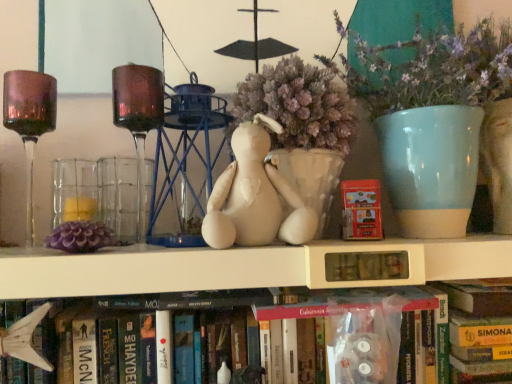
Question: Considering the relative positions of white fabric stuffed animal at center and matte red paperback book at center in the image provided, is white fabric stuffed animal at center in front of matte red paperback book at center?

Choices:
 (A) no
 (B) yes

Answer: (B)

Question: From the image's perspective, is white fabric stuffed animal at center on matte red paperback book at center?

Choices:
 (A) yes
 (B) no

Answer: (A)

Question: Is white fabric stuffed animal at center smaller than matte red paperback book at center?

Choices:
 (A) yes
 (B) no

Answer: (B)

Question: Is there a large distance between white fabric stuffed animal at center and matte red paperback book at center?

Choices:
 (A) no
 (B) yes

Answer: (A)

Question: Is white fabric stuffed animal at center turned away from matte red paperback book at center?

Choices:
 (A) yes
 (B) no

Answer: (B)

Question: In terms of width, does hardcover book at lower center, the first book in the right-to-left sequence, look wider or thinner when compared to white matte shelf at center?

Choices:
 (A) wide
 (B) thin

Answer: (B)

Question: In the image, is hardcover book at lower center, the 2th book from the left, positioned in front of or behind white matte shelf at center?

Choices:
 (A) front
 (B) behind

Answer: (B)

Question: From their relative heights in the image, would you say hardcover book at lower center, the 2th book from the left, is taller or shorter than white matte shelf at center?

Choices:
 (A) tall
 (B) short

Answer: (A)

Question: Does point (490, 375) appear closer or farther from the camera than point (419, 263)?

Choices:
 (A) farther
 (B) closer

Answer: (A)

Question: Is point (13, 97) closer or farther from the camera than point (268, 220)?

Choices:
 (A) closer
 (B) farther

Answer: (B)

Question: From the image's perspective, relative to white fabric stuffed animal at center, is amber glass wine glass at left above or below?

Choices:
 (A) above
 (B) below

Answer: (A)

Question: Considering their positions, is amber glass wine glass at left located in front of or behind white fabric stuffed animal at center?

Choices:
 (A) front
 (B) behind

Answer: (B)

Question: In terms of width, does amber glass wine glass at left look wider or thinner when compared to white fabric stuffed animal at center?

Choices:
 (A) thin
 (B) wide

Answer: (A)

Question: Is white matte shelf at center bigger or smaller than matte red paperback book at center?

Choices:
 (A) big
 (B) small

Answer: (A)

Question: Is white matte shelf at center in front of or behind matte red paperback book at center in the image?

Choices:
 (A) front
 (B) behind

Answer: (A)